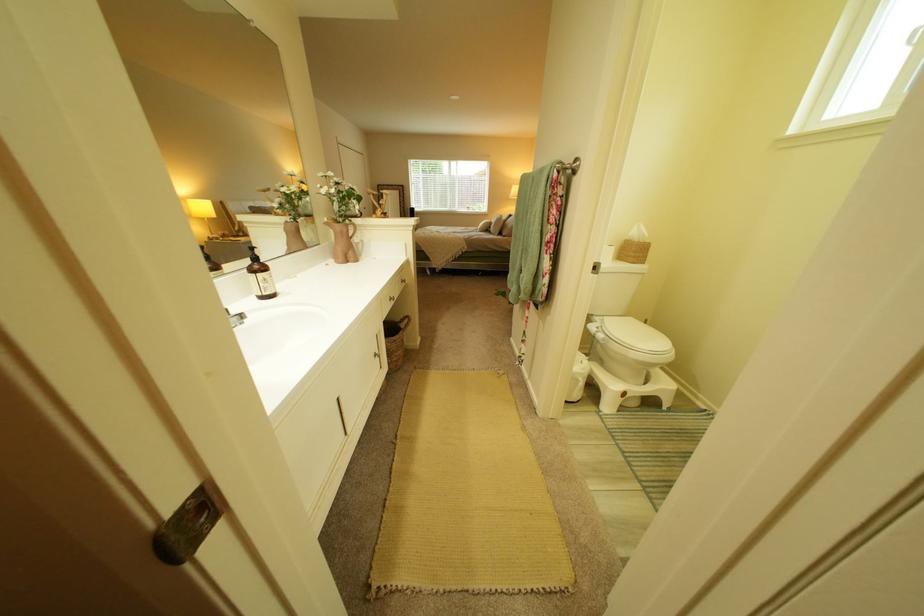
Identify the location of white toilet lid. (x=640, y=336).